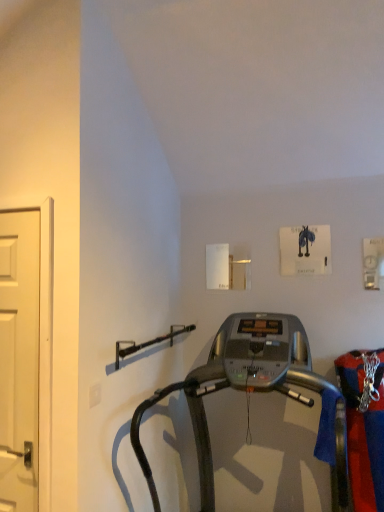
Question: Considering the relative sizes of silver metallic treadmill at center and white matte door at left in the image provided, is silver metallic treadmill at center bigger than white matte door at left?

Choices:
 (A) no
 (B) yes

Answer: (B)

Question: Does silver metallic treadmill at center come behind white matte door at left?

Choices:
 (A) no
 (B) yes

Answer: (A)

Question: Is silver metallic treadmill at center located outside white matte door at left?

Choices:
 (A) no
 (B) yes

Answer: (B)

Question: Is silver metallic treadmill at center wider than white matte door at left?

Choices:
 (A) no
 (B) yes

Answer: (B)

Question: Is silver metallic treadmill at center placed right next to white matte door at left?

Choices:
 (A) no
 (B) yes

Answer: (A)

Question: Is silver metallic treadmill at center looking in the opposite direction of white matte door at left?

Choices:
 (A) no
 (B) yes

Answer: (A)

Question: Is white matte door at left oriented towards silver metallic treadmill at center?

Choices:
 (A) no
 (B) yes

Answer: (A)

Question: Is white matte door at left at the right side of silver metallic treadmill at center?

Choices:
 (A) yes
 (B) no

Answer: (B)

Question: From the image's perspective, is white matte door at left over silver metallic treadmill at center?

Choices:
 (A) no
 (B) yes

Answer: (B)

Question: Is white matte door at left next to silver metallic treadmill at center and touching it?

Choices:
 (A) no
 (B) yes

Answer: (A)

Question: Can you confirm if white matte door at left is taller than silver metallic treadmill at center?

Choices:
 (A) no
 (B) yes

Answer: (A)

Question: Can you confirm if white matte door at left is bigger than silver metallic treadmill at center?

Choices:
 (A) yes
 (B) no

Answer: (B)

Question: Is point (258, 357) positioned closer to the camera than point (21, 269)?

Choices:
 (A) closer
 (B) farther

Answer: (B)